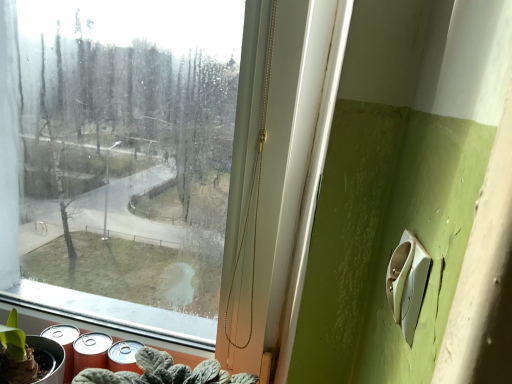
Question: Should I look upward or downward to see white plastic light switch at lower right?

Choices:
 (A) down
 (B) up

Answer: (A)

Question: Considering the relative positions of green matte plant at lower left and white plastic light switch at lower right in the image provided, is green matte plant at lower left behind white plastic light switch at lower right?

Choices:
 (A) no
 (B) yes

Answer: (B)

Question: Is green matte plant at lower left far away from white plastic light switch at lower right?

Choices:
 (A) no
 (B) yes

Answer: (A)

Question: Is green matte plant at lower left located outside white plastic light switch at lower right?

Choices:
 (A) no
 (B) yes

Answer: (B)

Question: Does green matte plant at lower left have a greater height compared to white plastic light switch at lower right?

Choices:
 (A) yes
 (B) no

Answer: (A)

Question: Is green matte plant at lower left positioned in front of white plastic light switch at lower right?

Choices:
 (A) no
 (B) yes

Answer: (A)

Question: Considering the relative sizes of green matte plant at lower left and white plastic light switch at lower right in the image provided, is green matte plant at lower left thinner than white plastic light switch at lower right?

Choices:
 (A) yes
 (B) no

Answer: (B)

Question: Considering the relative sizes of metallic silver spray can at lower left and white plastic light switch at lower right in the image provided, is metallic silver spray can at lower left thinner than white plastic light switch at lower right?

Choices:
 (A) no
 (B) yes

Answer: (A)

Question: From the image's perspective, would you say metallic silver spray can at lower left is positioned over white plastic light switch at lower right?

Choices:
 (A) yes
 (B) no

Answer: (B)

Question: Is metallic silver spray can at lower left facing towards white plastic light switch at lower right?

Choices:
 (A) no
 (B) yes

Answer: (A)

Question: Is white plastic light switch at lower right surrounded by metallic silver spray can at lower left?

Choices:
 (A) no
 (B) yes

Answer: (A)

Question: Considering the relative positions of metallic silver spray can at lower left and white plastic light switch at lower right in the image provided, is metallic silver spray can at lower left behind white plastic light switch at lower right?

Choices:
 (A) no
 (B) yes

Answer: (B)

Question: Does metallic silver spray can at lower left appear on the left side of white plastic light switch at lower right?

Choices:
 (A) no
 (B) yes

Answer: (B)

Question: Is green matte plant at lower left bigger than transparent glass window at center?

Choices:
 (A) yes
 (B) no

Answer: (B)